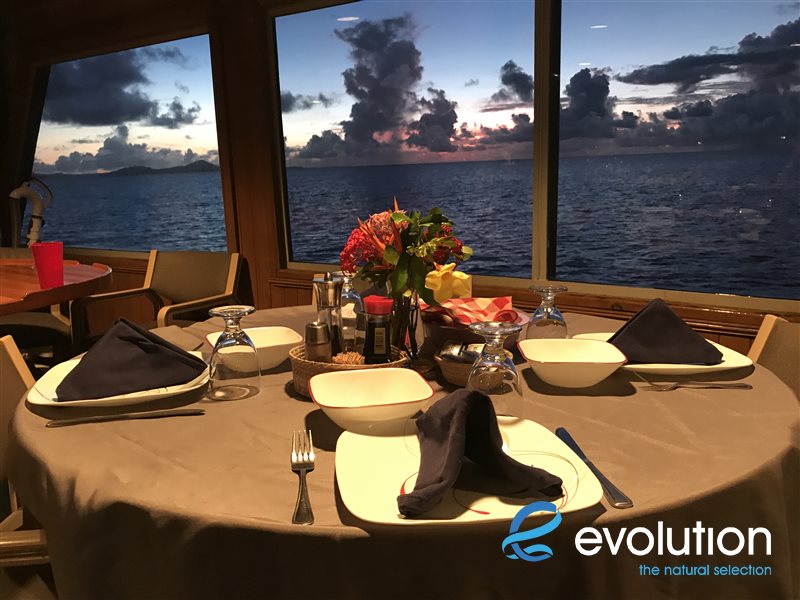
Where is `plate`? The width and height of the screenshot is (800, 600). plate is located at coordinates (366, 438), (534, 429), (736, 360), (597, 333), (352, 314), (185, 391), (34, 397), (198, 351).